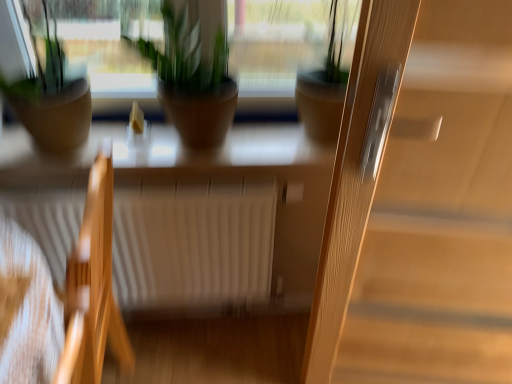
Question: Is green matte plant pot at center, which ranks as the 3th houseplant in left-to-right order, not inside wooden chair at left?

Choices:
 (A) yes
 (B) no

Answer: (A)

Question: From the image's perspective, would you say green matte plant pot at center, which ranks as the 3th houseplant in left-to-right order, is shown under wooden chair at left?

Choices:
 (A) yes
 (B) no

Answer: (B)

Question: Is green matte plant pot at center, the first houseplant from the right, turned away from wooden chair at left?

Choices:
 (A) yes
 (B) no

Answer: (B)

Question: From a real-world perspective, is green matte plant pot at center, the first houseplant from the right, located beneath wooden chair at left?

Choices:
 (A) yes
 (B) no

Answer: (B)

Question: Is green matte plant pot at center, the first houseplant from the right, bigger than wooden chair at left?

Choices:
 (A) yes
 (B) no

Answer: (B)

Question: From the image's perspective, is white matte radiator at center above or below matte brown pot at center, acting as the 2th houseplant starting from the left?

Choices:
 (A) above
 (B) below

Answer: (B)

Question: Is point (256, 231) closer or farther from the camera than point (145, 56)?

Choices:
 (A) farther
 (B) closer

Answer: (A)

Question: Considering the positions of white matte radiator at center and matte brown pot at center, which is counted as the second houseplant, starting from the right, in the image, is white matte radiator at center wider or thinner than matte brown pot at center, which is counted as the second houseplant, starting from the right,?

Choices:
 (A) thin
 (B) wide

Answer: (A)

Question: In the image, is white matte radiator at center on the left side or the right side of matte brown pot at center, acting as the 2th houseplant starting from the left?

Choices:
 (A) left
 (B) right

Answer: (A)

Question: Considering the positions of white matte radiator at center and green matte plant pot at center, which ranks as the 3th houseplant in left-to-right order, in the image, is white matte radiator at center bigger or smaller than green matte plant pot at center, which ranks as the 3th houseplant in left-to-right order,?

Choices:
 (A) small
 (B) big

Answer: (B)

Question: Is white matte radiator at center to the left or to the right of green matte plant pot at center, which ranks as the 3th houseplant in left-to-right order, in the image?

Choices:
 (A) left
 (B) right

Answer: (A)

Question: Is white matte radiator at center wider or thinner than green matte plant pot at center, the first houseplant from the right?

Choices:
 (A) wide
 (B) thin

Answer: (B)

Question: From a real-world perspective, relative to green matte plant pot at center, the first houseplant from the right, is white matte radiator at center vertically above or below?

Choices:
 (A) below
 (B) above

Answer: (A)

Question: From a real-world perspective, is white matte radiator at center above or below matte brown pot at left, which is counted as the third houseplant, starting from the right?

Choices:
 (A) above
 (B) below

Answer: (B)

Question: Is white matte radiator at center inside the boundaries of matte brown pot at left, which is the first houseplant from left to right, or outside?

Choices:
 (A) outside
 (B) inside

Answer: (A)